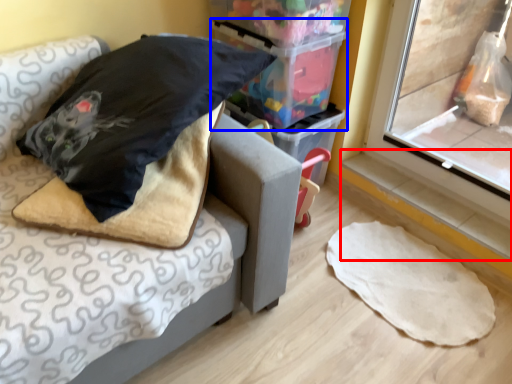
Question: Which object is closer to the camera taking this photo, window sill (highlighted by a red box) or storage box (highlighted by a blue box)?

Choices:
 (A) window sill
 (B) storage box

Answer: (B)